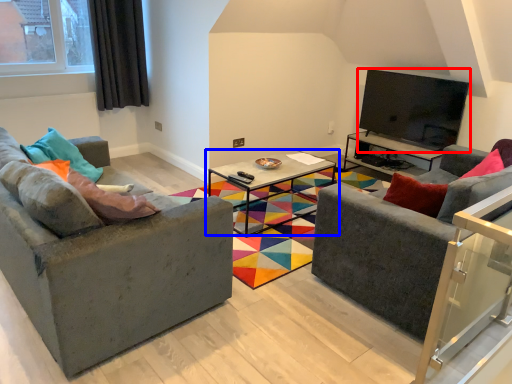
Question: Which of the following is the closest to the observer, television (highlighted by a red box) or coffee table (highlighted by a blue box)?

Choices:
 (A) television
 (B) coffee table

Answer: (B)